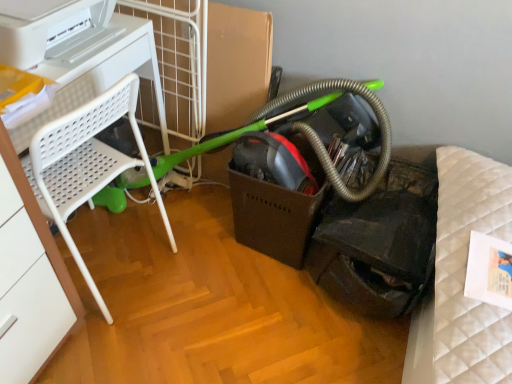
Locate an element on the screen. The height and width of the screenshot is (384, 512). free space in front of white plastic chair at left is located at coordinates (115, 348).